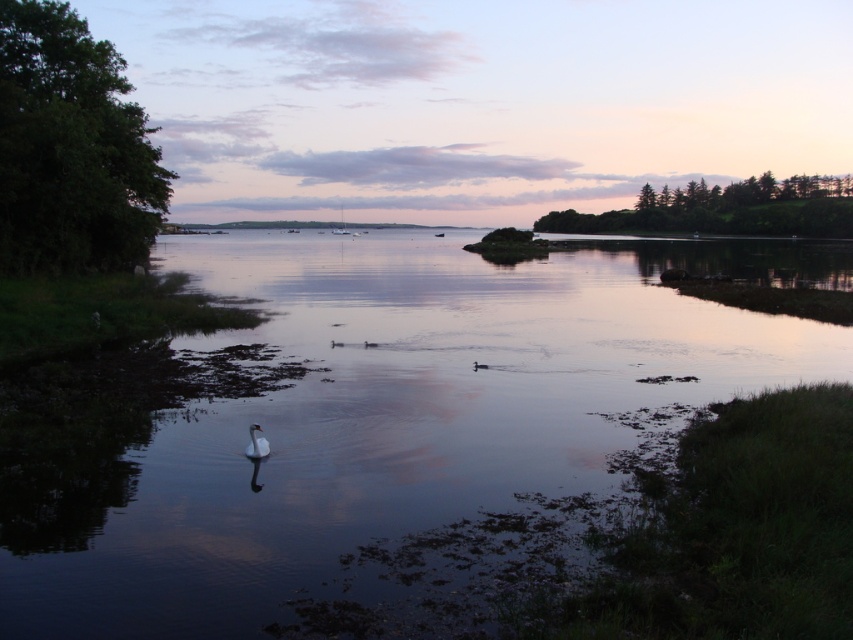
Between green leafy tree at left and green leafy trees at upper right, which one has less height?

With less height is green leafy tree at left.

Can you confirm if green leafy tree at left is positioned to the left of green leafy trees at upper right?

Indeed, green leafy tree at left is positioned on the left side of green leafy trees at upper right.

Which is behind, point (78, 186) or point (606, 214)?

The point (606, 214) is behind.

Locate an element on the screen. The height and width of the screenshot is (640, 853). green leafy tree at left is located at coordinates [70, 148].

Is clear water at center shorter than green leafy tree at left?

Yes, clear water at center is shorter than green leafy tree at left.

This screenshot has height=640, width=853. Identify the location of clear water at center. (393, 413).

I want to click on clear water at center, so pos(393,413).

Which is more to the right, clear water at center or white glossy swan at lower center?

clear water at center

The image size is (853, 640). Describe the element at coordinates (393, 413) in the screenshot. I see `clear water at center` at that location.

Find the location of `clear water at center`. clear water at center is located at coordinates coord(393,413).

Image resolution: width=853 pixels, height=640 pixels. I want to click on clear water at center, so click(x=393, y=413).